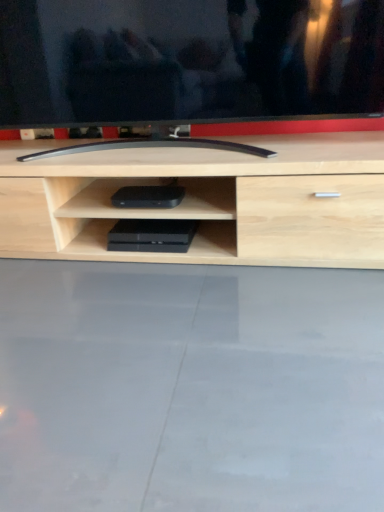
Question: Considering the positions of black glossy tv at center and black plastic game console at center, positioned as the second equipment in top-to-bottom order, in the image, is black glossy tv at center taller or shorter than black plastic game console at center, positioned as the second equipment in top-to-bottom order,?

Choices:
 (A) tall
 (B) short

Answer: (A)

Question: Looking at their shapes, would you say black glossy tv at center is wider or thinner than black plastic game console at center, positioned as the second equipment in top-to-bottom order?

Choices:
 (A) thin
 (B) wide

Answer: (B)

Question: Which of these objects is positioned farthest from the black plastic game console at center, positioned as the second equipment in top-to-bottom order?

Choices:
 (A) black plastic device at center, the 2th equipment when ordered from bottom to top
 (B) black glossy tv at center

Answer: (B)

Question: Which of these objects is positioned farthest from the black plastic device at center, which is the 1th equipment from top to bottom?

Choices:
 (A) black plastic game console at center, positioned as the second equipment in top-to-bottom order
 (B) black glossy tv at center

Answer: (B)